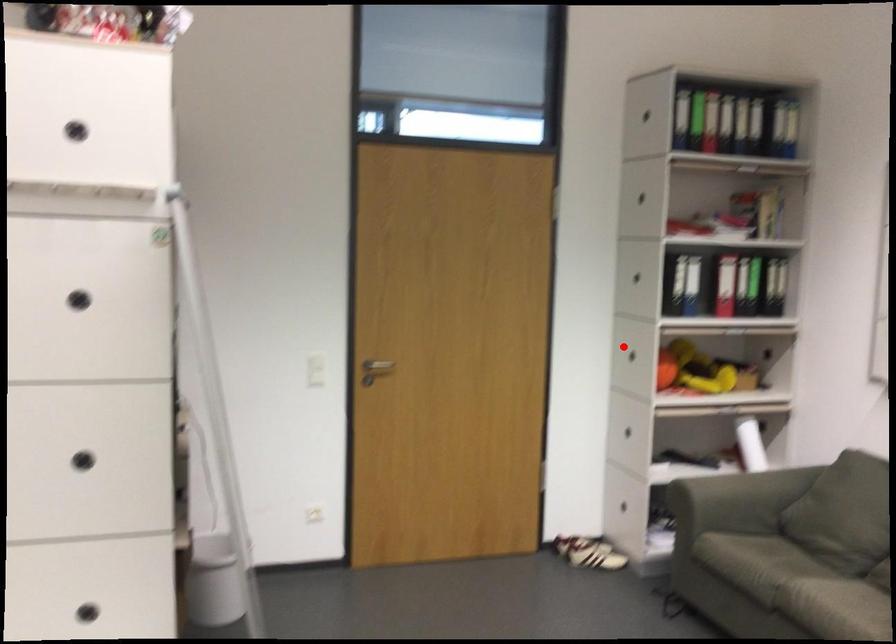
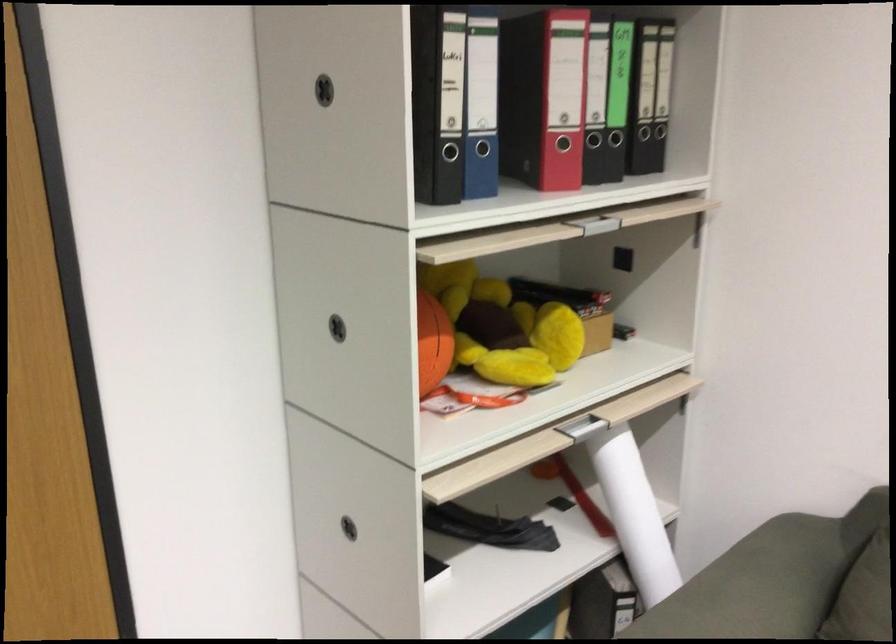
Question: A red point is marked in image1. In image2, is the corresponding 3D point closer to the camera or farther? Reply with the corresponding letter.

Choices:
 (A) The corresponding 3D point is closer.
 (B) The corresponding 3D point is farther.

Answer: (A)